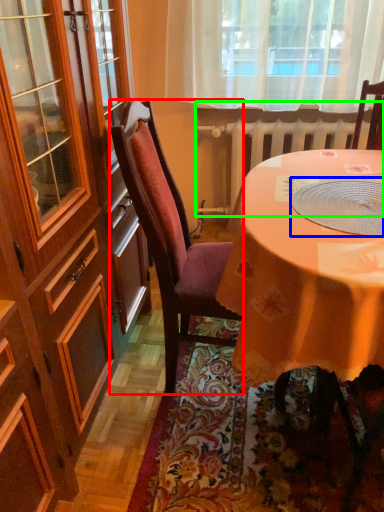
Question: Based on their relative distances, which object is farther from chair (highlighted by a red box)? Choose from tableware (highlighted by a blue box) and radiator (highlighted by a green box).

Choices:
 (A) tableware
 (B) radiator

Answer: (B)